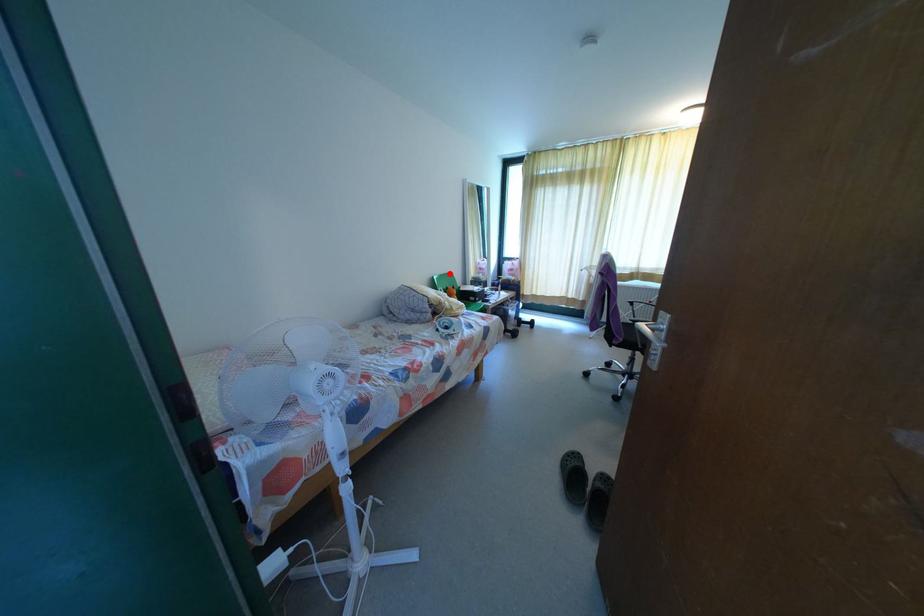
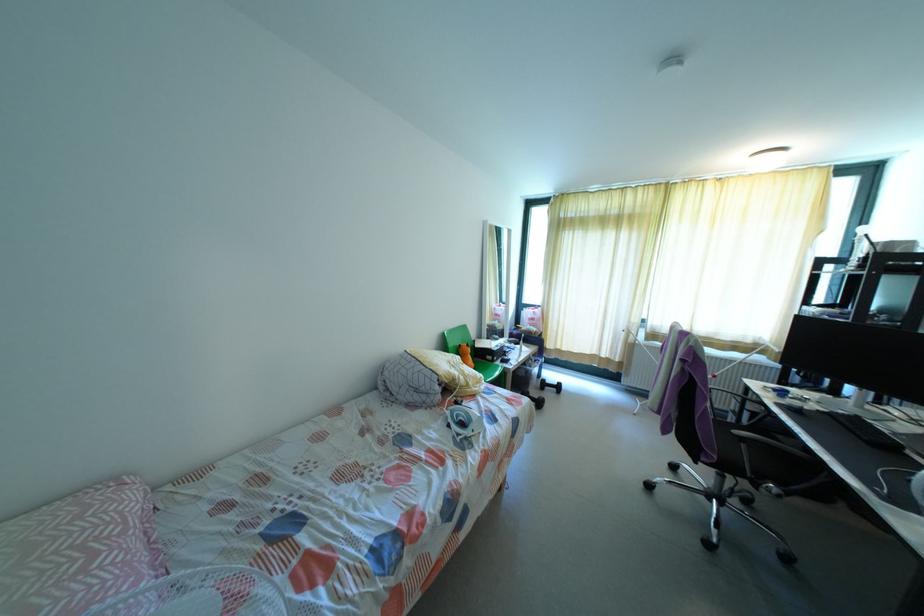
Locate, in the second image, the point that corresponds to the highlighted location in the first image.

(464, 328)